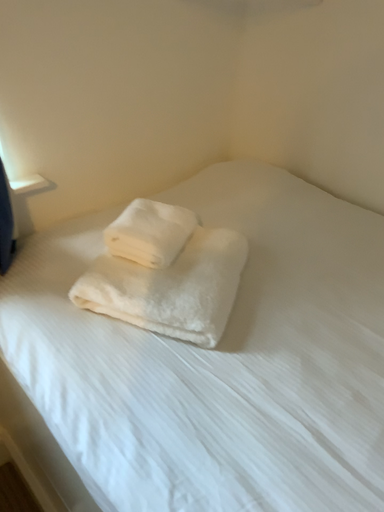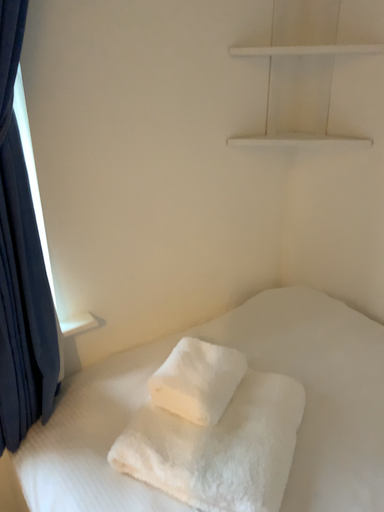
Question: How did the camera likely rotate when shooting the video?

Choices:
 (A) rotated upward
 (B) rotated downward

Answer: (A)